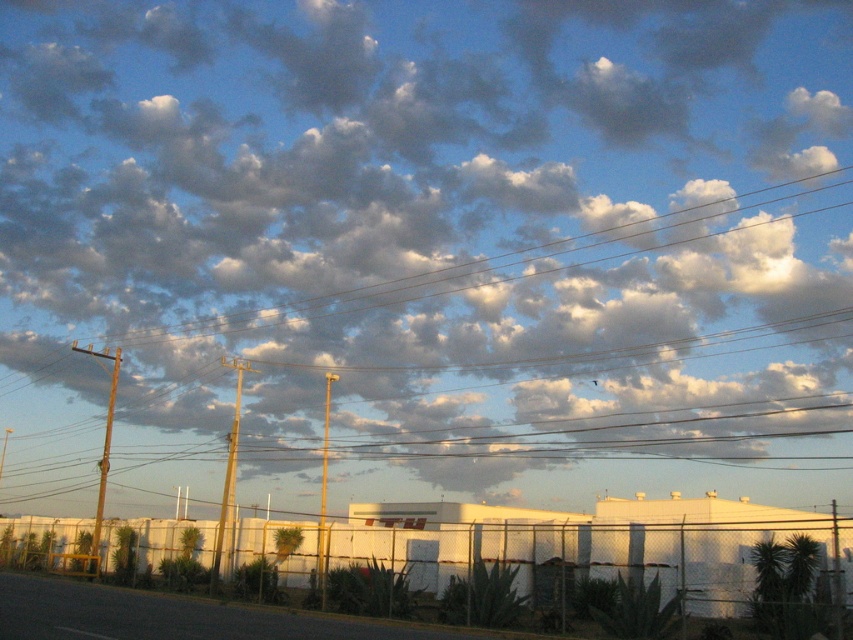
Question: Which point appears closest to the camera in this image?

Choices:
 (A) (238, 403)
 (B) (109, 433)
 (C) (325, 477)

Answer: (B)

Question: Which point is farther from the camera taking this photo?

Choices:
 (A) (114, 380)
 (B) (222, 499)

Answer: (B)

Question: Which is nearer to the metallic pole at left?

Choices:
 (A) smooth wood pole at center
 (B) metallic pole at center

Answer: (A)

Question: Can you confirm if smooth wood pole at center is positioned to the left of metallic pole at left?

Choices:
 (A) yes
 (B) no

Answer: (B)

Question: Can you confirm if smooth wood pole at center is bigger than metallic pole at left?

Choices:
 (A) no
 (B) yes

Answer: (A)

Question: Can you confirm if smooth wood pole at center is smaller than metallic pole at center?

Choices:
 (A) yes
 (B) no

Answer: (A)